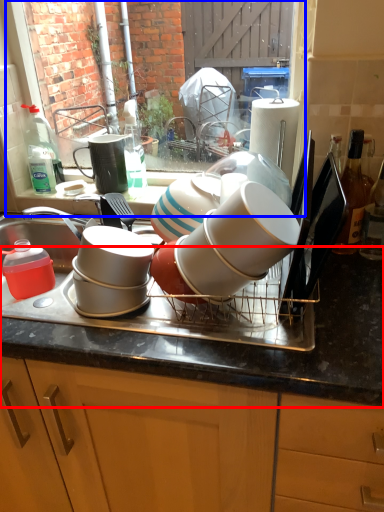
Question: Which object is closer to the camera taking this photo, countertop (highlighted by a red box) or window (highlighted by a blue box)?

Choices:
 (A) countertop
 (B) window

Answer: (A)